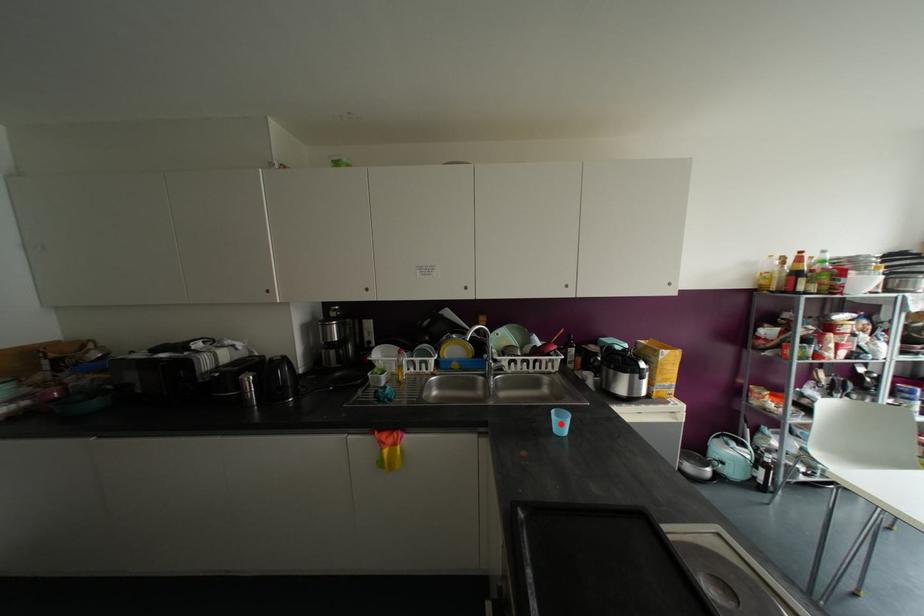
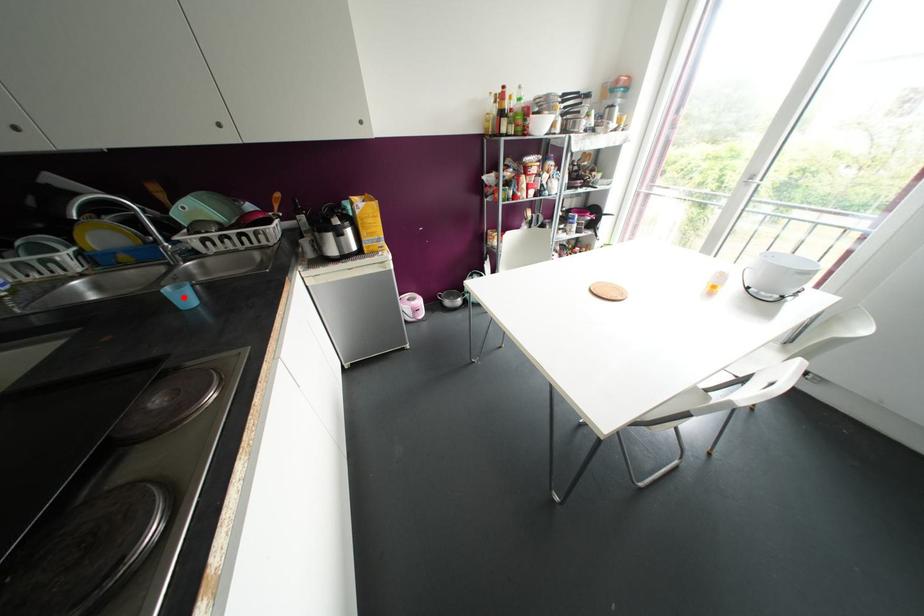
I am providing you with two images of the same scene from different viewpoints. A red point is marked on the first image and another point is marked on the second image. Does the point marked in image1 correspond to the same location as the one in image2?

Yes